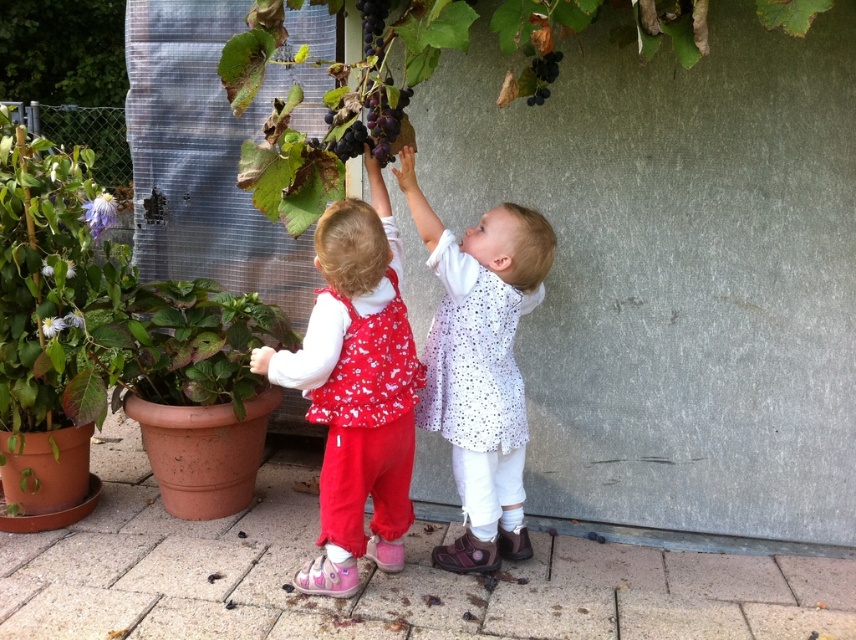
Which of these two, green matte plant at left or green matte plant at lower left, stands shorter?

With less height is green matte plant at lower left.

The height and width of the screenshot is (640, 856). What are the coordinates of `green matte plant at left` in the screenshot? It's located at tap(52, 316).

Does point (161, 356) lie in front of point (343, 148)?

No, it is not.

Can you confirm if green matte plant at lower left is shorter than dark purple grapes at center?

In fact, green matte plant at lower left may be taller than dark purple grapes at center.

Between point (189, 317) and point (345, 160), which one is positioned in front?

Point (345, 160) is in front.

At what (x,y) coordinates should I click in order to perform the action: click on green matte plant at lower left. Please return your answer as a coordinate pair (x, y). Looking at the image, I should click on (198, 342).

Which of these two, matte red pants at center or ripe purple grapes at upper center, stands taller?

matte red pants at center is taller.

Which of these two, matte red pants at center or ripe purple grapes at upper center, stands shorter?

ripe purple grapes at upper center is shorter.

You are a GUI agent. You are given a task and a screenshot of the screen. Output one action in this format:
    pyautogui.click(x=<x>, y=<y>)
    Task: Click on the matte red pants at center
    
    Given the screenshot: What is the action you would take?
    coord(355,388)